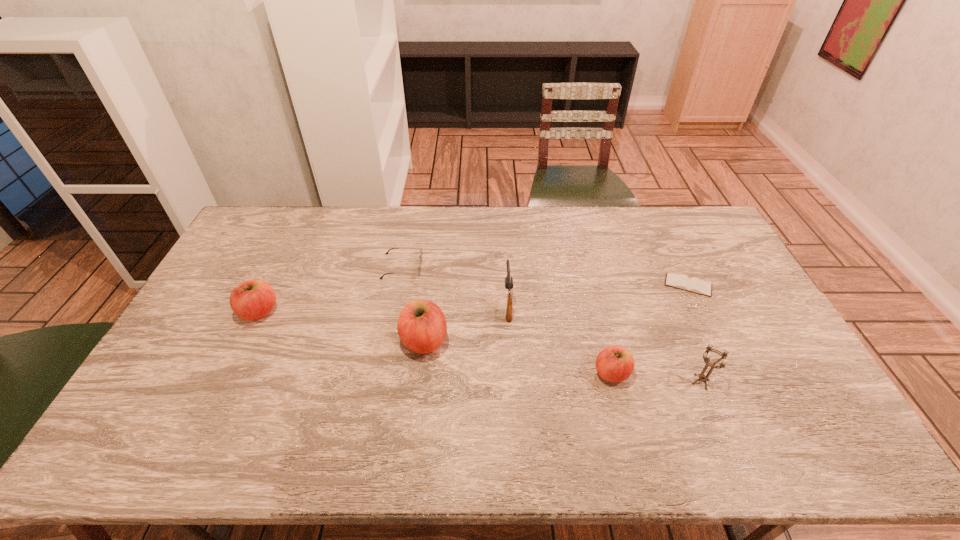
Image resolution: width=960 pixels, height=540 pixels. Find the location of `the second shortest apple`. the second shortest apple is located at coordinates (254, 299).

This screenshot has width=960, height=540. Identify the location of the leftmost object. (254, 299).

Find the location of a particular element. the second apple from left to right is located at coordinates (421, 325).

This screenshot has height=540, width=960. I want to click on the fifth object from left to right, so click(x=615, y=364).

Locate an element on the screen. This screenshot has width=960, height=540. the rightmost apple is located at coordinates (615, 364).

Where is `sunglasses`? The height and width of the screenshot is (540, 960). sunglasses is located at coordinates (420, 253).

You are a GUI agent. You are given a task and a screenshot of the screen. Output one action in this format:
    pyautogui.click(x=<x>, y=<y>)
    Task: Click on the diary
    
    Given the screenshot: What is the action you would take?
    pyautogui.click(x=680, y=281)

At what (x,y) coordinates should I click in order to perform the action: click on gun. Please return your answer as a coordinate pair (x, y). This screenshot has width=960, height=540. Looking at the image, I should click on (508, 280).

Identify the location of candle holder. The image size is (960, 540). (702, 377).

Locate an element on the screen. The width and height of the screenshot is (960, 540). free location located on the back of the leftmost apple is located at coordinates (276, 279).